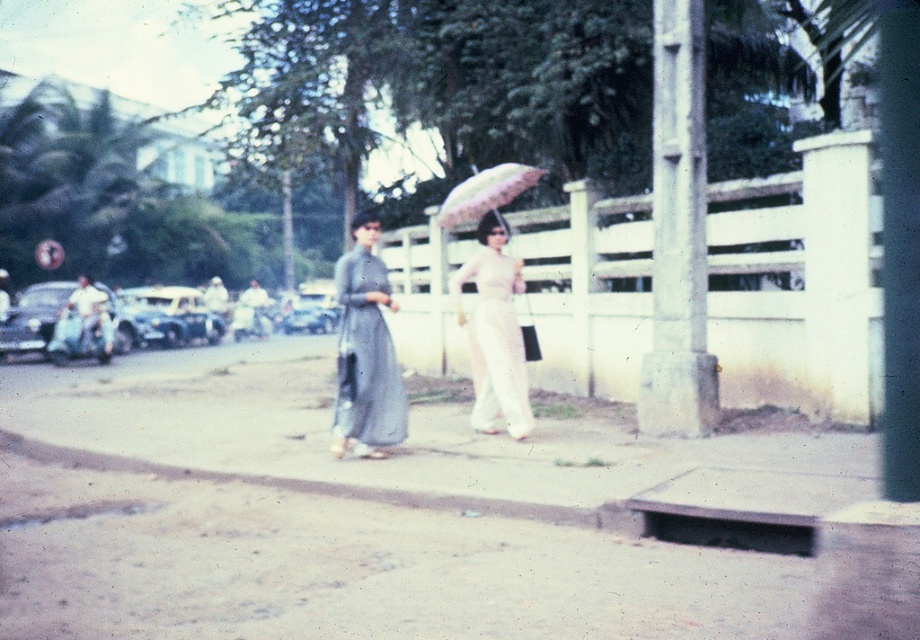
Is smooth concrete pavement at center shorter than white matte dress at center?

Yes.

Is smooth concrete pavement at center taller than white matte dress at center?

No.

I want to click on smooth concrete pavement at center, so click(409, 516).

Does point (106, 358) lie behind point (249, 296)?

That is False.

Between point (83, 330) and point (263, 336), which one is positioned in front?

Point (83, 330) is more forward.

What are the coordinates of `light blue denim jeans at left` in the screenshot? It's located at (92, 317).

Can you confirm if white matte dress at center is bigger than metallic silver car at left?

Actually, white matte dress at center might be smaller than metallic silver car at left.

Is white matte dress at center above metallic silver car at left?

No.

Locate an element on the screen. white matte dress at center is located at coordinates (493, 333).

Where is `white matte dress at center`? white matte dress at center is located at coordinates (493, 333).